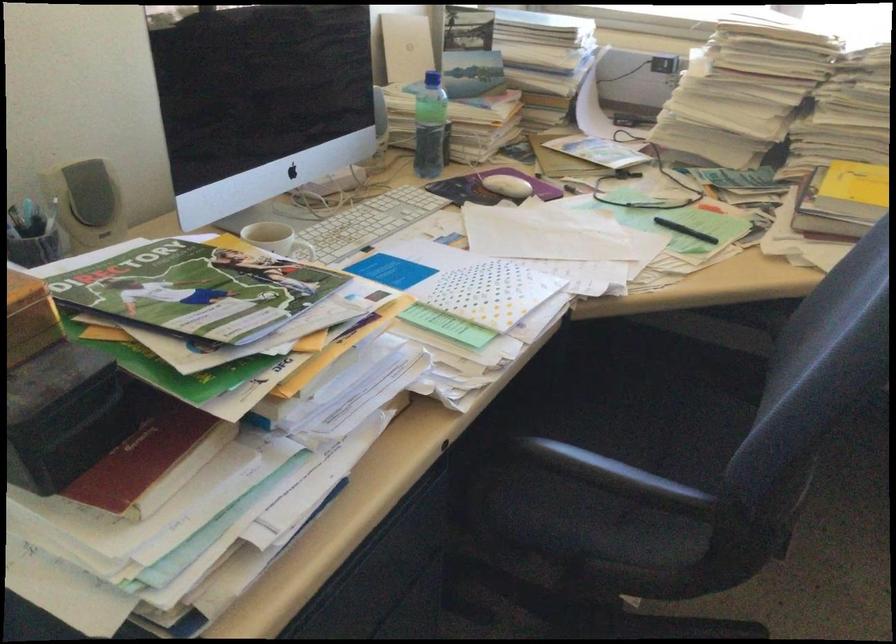
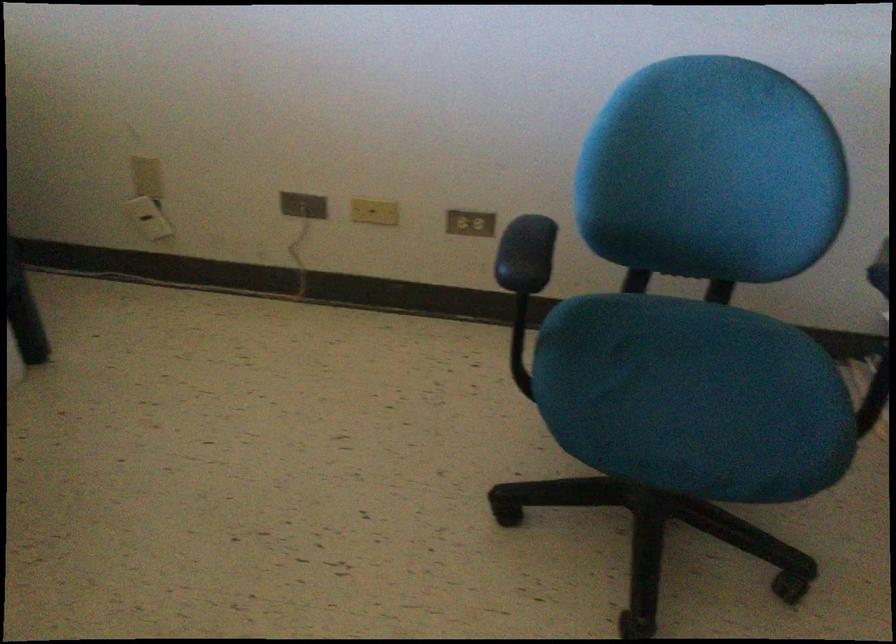
The first image is from the beginning of the video and the second image is from the end. How did the camera likely rotate when shooting the video?

The camera's rotation is toward right-down.